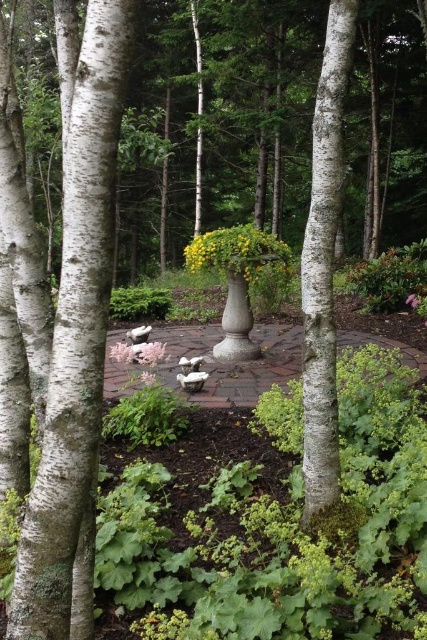
Question: Is white smooth tree trunk at center positioned before pink matte flower at center?

Choices:
 (A) no
 (B) yes

Answer: (B)

Question: Among these points, which one is nearest to the camera?

Choices:
 (A) (242, 225)
 (B) (38, 513)

Answer: (B)

Question: Which object is the farthest from the white matte flower at center?

Choices:
 (A) white matte rock at lower center
 (B) yellow matte flower at center
 (C) pink matte flower at center
 (D) white stone path at center

Answer: (C)

Question: Which object is positioned farthest from the white smooth tree trunk at center?

Choices:
 (A) yellow matte flower at center
 (B) white stone path at center
 (C) white matte rock at lower center

Answer: (A)

Question: Is yellow matte flower at center thinner than white matte rock at lower center?

Choices:
 (A) no
 (B) yes

Answer: (B)

Question: Can you confirm if yellow matte flower at center is bigger than white matte rock at lower center?

Choices:
 (A) no
 (B) yes

Answer: (A)